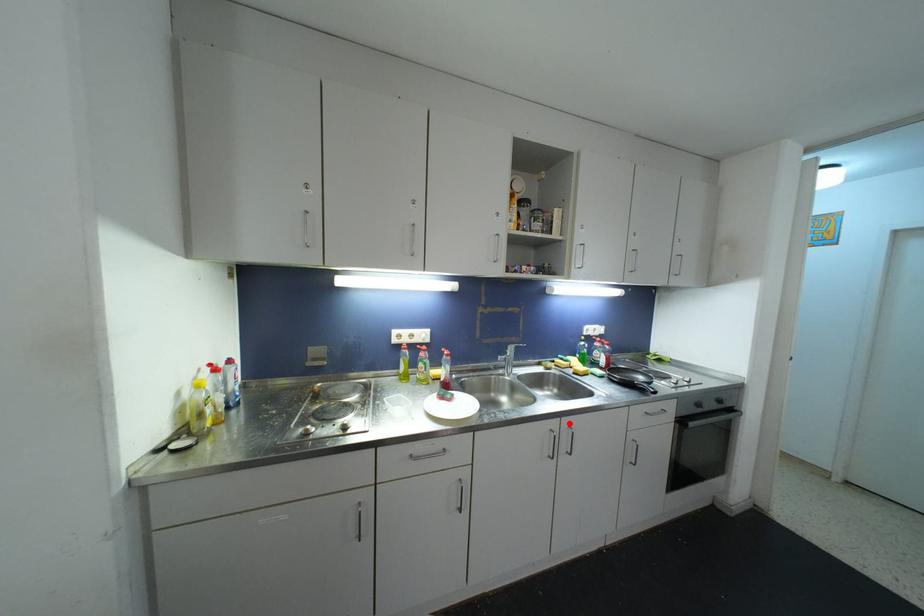
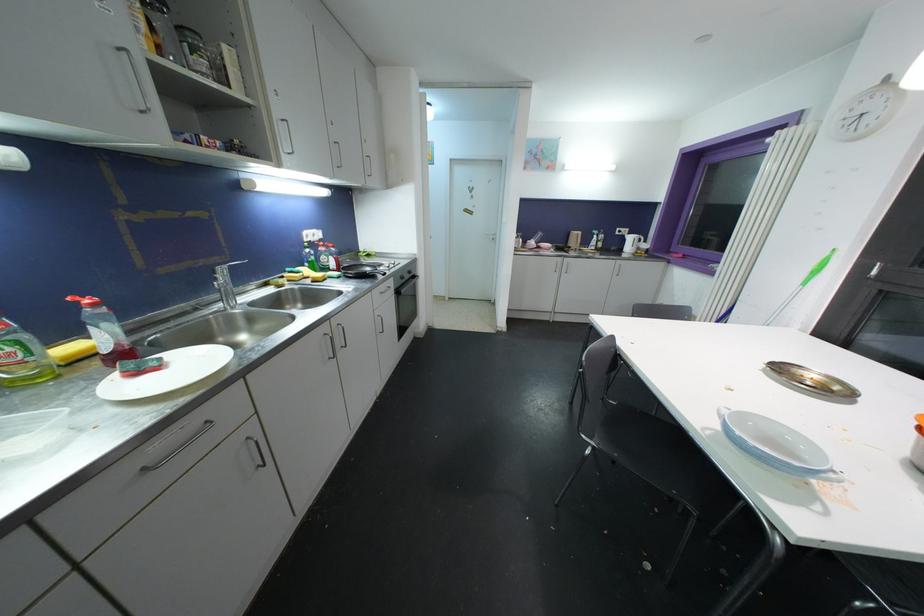
In the second image, find the point that corresponds to the highlighted location in the first image.

(337, 323)